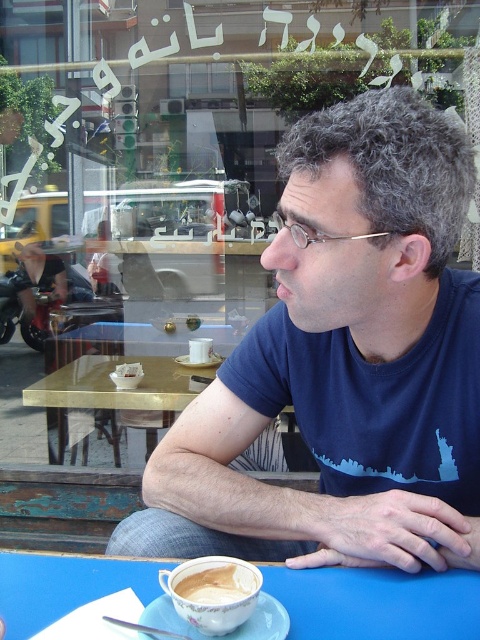
You are a barista who needs to place a new cup of coffee on the table. The cup you have is 3 inches in diameter. Can you safely place it on the gold reflective table at center without touching the existing white ceramic cup at center?

The gold reflective table at center and white ceramic cup at center are 12.86 inches apart. Since the new cup is 3 inches in diameter, placing it anywhere on the table outside of the 1.5 inch radius around the existing cup would ensure it doesn,t touch. Therefore, yes, you can safely place the new cup on the gold reflective table at center without touching the existing white ceramic cup at center.

You are standing in front of the window of the cafe. You see the gold reflective table at center. Can you determine its exact position based on the coordinate system provided?

The gold reflective table at center is located at point coordinates (113, 387).

You are a customer in the cafe and want to place your phone on the table. There are two points marked on the table. Which point is closer to you, point (243, 628) or point (251, 593)?

Point (251, 593) is closer to you because it is less further to the camera than point (243, 628).